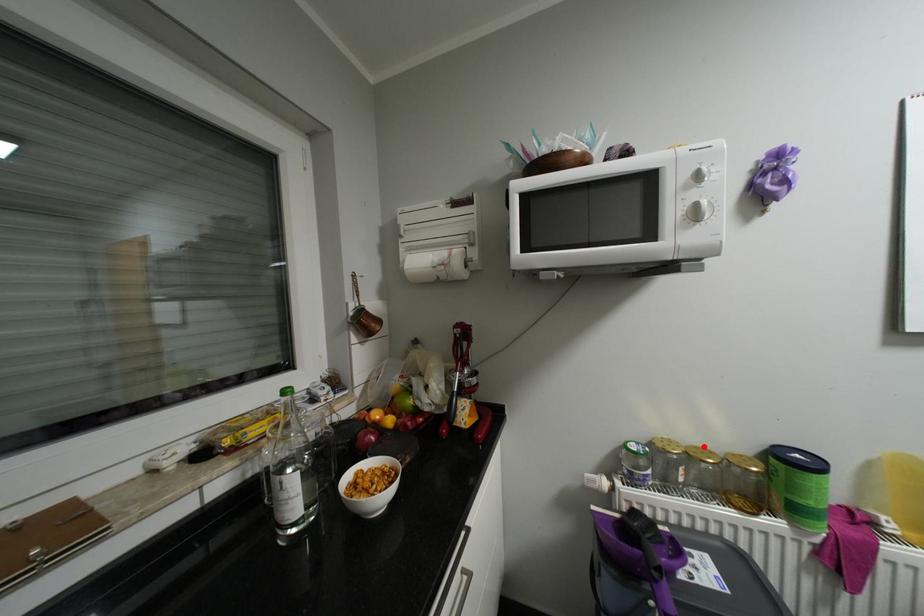
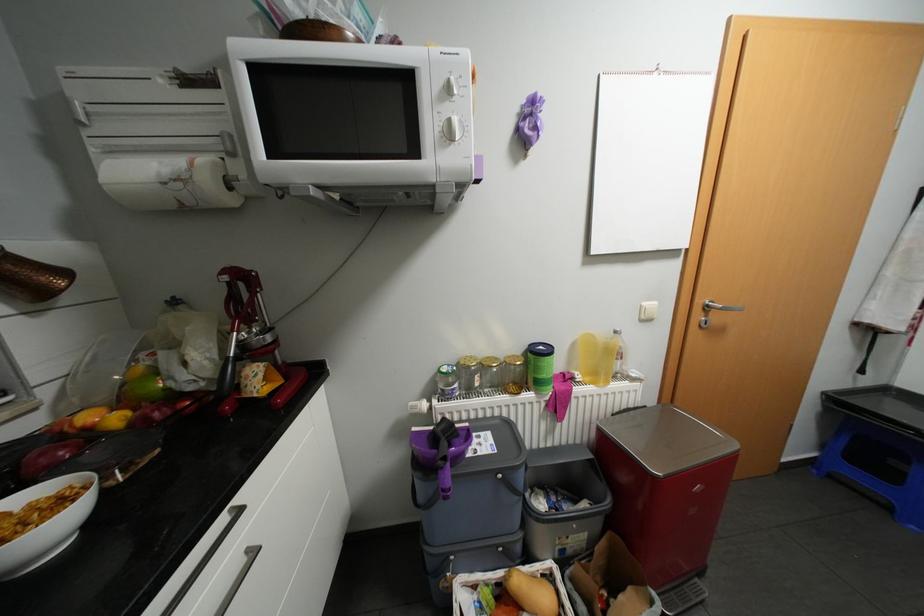
Locate, in the second image, the point that corresponds to the highlighted location in the first image.

(495, 357)